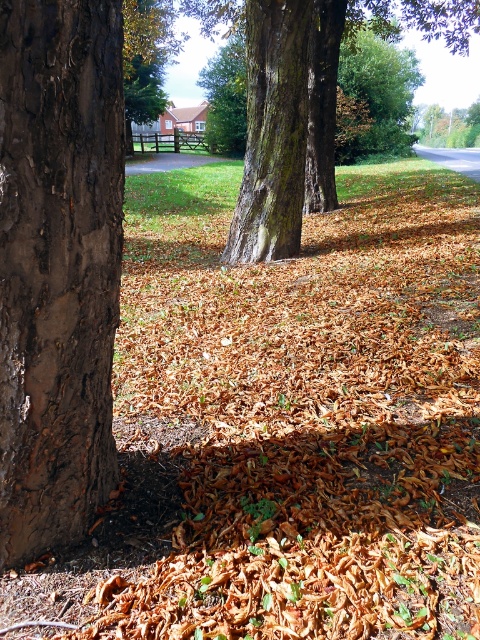
Question: Which object is the closest to the smooth bark tree trunk at center?

Choices:
 (A) smooth bark tree at center
 (B) brown rough bark at left

Answer: (A)

Question: Which of the following is the farthest from the observer?

Choices:
 (A) (260, 108)
 (B) (264, 118)

Answer: (A)

Question: Does brown rough bark at left appear under smooth bark tree trunk at center?

Choices:
 (A) yes
 (B) no

Answer: (A)

Question: Can you confirm if smooth bark tree at center is wider than smooth bark tree trunk at center?

Choices:
 (A) yes
 (B) no

Answer: (A)

Question: Which is nearer to the brown rough bark at left?

Choices:
 (A) smooth bark tree at center
 (B) smooth bark tree trunk at center

Answer: (B)

Question: Where is smooth bark tree at center located in relation to smooth bark tree trunk at center in the image?

Choices:
 (A) below
 (B) above

Answer: (B)